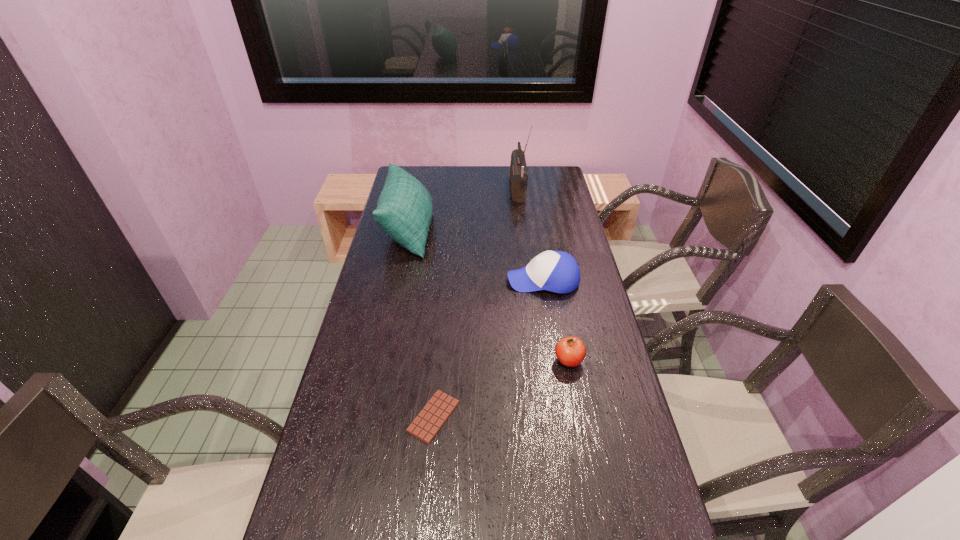
At what (x,y) coordinates should I click in order to perform the action: click on baseball cap that is at the right edge. Please return your answer as a coordinate pair (x, y). The image size is (960, 540). Looking at the image, I should click on (557, 271).

Image resolution: width=960 pixels, height=540 pixels. I want to click on vacant position at the far edge of the desktop, so click(x=473, y=181).

You are a GUI agent. You are given a task and a screenshot of the screen. Output one action in this format:
    pyautogui.click(x=<x>, y=<y>)
    Task: Click on the free region at the left edge of the desktop
    This screenshot has height=540, width=960.
    Given the screenshot: What is the action you would take?
    pyautogui.click(x=354, y=402)

Find the location of a particular element. This screenshot has height=540, width=960. vacant space at the right edge of the desktop is located at coordinates (596, 351).

Locate an element on the screen. vacant space at the far left corner of the desktop is located at coordinates (417, 176).

You are a GUI agent. You are given a task and a screenshot of the screen. Output one action in this format:
    pyautogui.click(x=<x>, y=<y>)
    Task: Click on the vacant area at the far right corner
    The width and height of the screenshot is (960, 540).
    Given the screenshot: What is the action you would take?
    pyautogui.click(x=561, y=174)

Where is `vacant space in between the tallest object and the second farthest object`? vacant space in between the tallest object and the second farthest object is located at coordinates (463, 210).

Where is `vacant area that lies between the nearest object and the fourth shortest object`? The height and width of the screenshot is (540, 960). vacant area that lies between the nearest object and the fourth shortest object is located at coordinates (421, 323).

Locate an element on the screen. empty space between the radio receiver and the baseball cap is located at coordinates (530, 235).

Where is `blank region between the fourth shortest object and the apple`? blank region between the fourth shortest object and the apple is located at coordinates (489, 296).